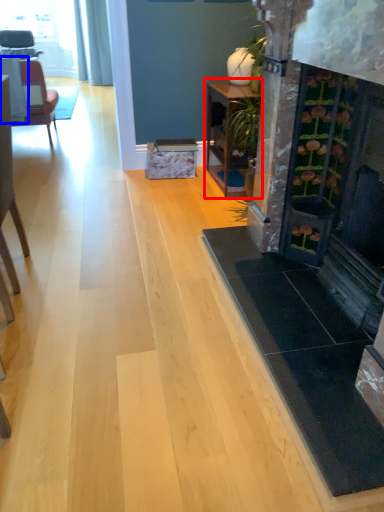
Question: Which object is closer to the camera taking this photo, table (highlighted by a red box) or table (highlighted by a blue box)?

Choices:
 (A) table
 (B) table

Answer: (A)